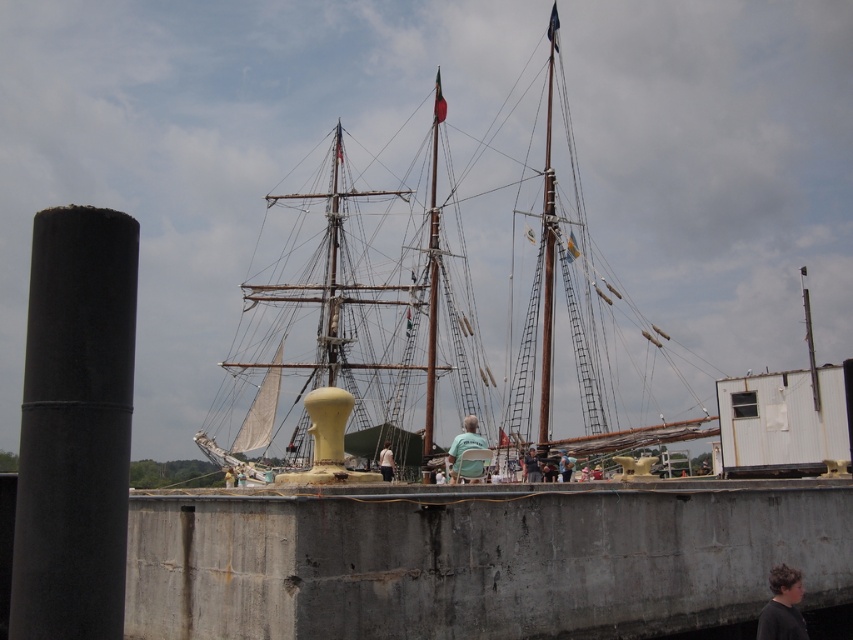
You are standing on the pier and want to board the wooden ship at center. Based on its location, which direction should you walk to reach it?

The wooden ship at center is located at point (393,289), so you should walk towards the center of the pier to reach it.

You are standing on the pier and want to take a photo of the ship. You notice two points marked on the image. Which point, point (129, 259) or point (793, 625), is closer to you?

Point (129, 259) is closer to the camera than point (793, 625), so it is closer to you.